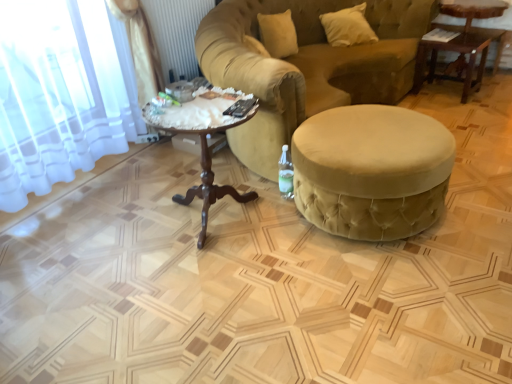
Find the location of `vacant area that is in front of clear glass bottle at lower right`. vacant area that is in front of clear glass bottle at lower right is located at coordinates (282, 213).